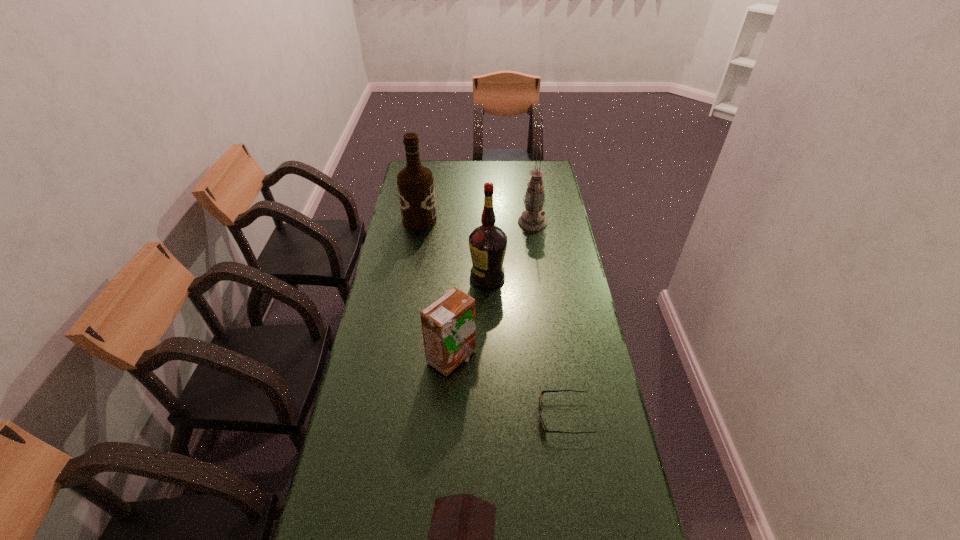
Image resolution: width=960 pixels, height=540 pixels. Identify the location of blank space located on the label of the nearer alcohol. (432, 277).

Where is `vacant space positioned 0.210m on the label of the nearer alcohol`? Image resolution: width=960 pixels, height=540 pixels. vacant space positioned 0.210m on the label of the nearer alcohol is located at coordinates (414, 277).

Where is `blank area located on the label of the farther alcohol`? The height and width of the screenshot is (540, 960). blank area located on the label of the farther alcohol is located at coordinates (482, 220).

Identify the location of vacant space located 0.380m on the back of the oil lamp. The image size is (960, 540). (525, 170).

Locate an element on the screen. The image size is (960, 540). vacant space located on the straw side of the carton is located at coordinates (600, 358).

You are a GUI agent. You are given a task and a screenshot of the screen. Output one action in this format:
    pyautogui.click(x=<x>, y=<y>)
    Task: Click on the vacant space situated on the front-facing side of the shortest object
    Image resolution: width=960 pixels, height=540 pixels.
    Given the screenshot: What is the action you would take?
    pyautogui.click(x=484, y=416)

The image size is (960, 540). In order to click on vacant region located 0.180m on the front-facing side of the shortest object in this screenshot , I will do `click(473, 416)`.

Identify the location of free space located on the front-facing side of the shortest object. This screenshot has height=540, width=960. (459, 416).

Find the location of a particular element. This screenshot has width=960, height=540. object that is at the left edge is located at coordinates (415, 183).

Identify the location of oil lamp present at the right edge. This screenshot has width=960, height=540. (532, 219).